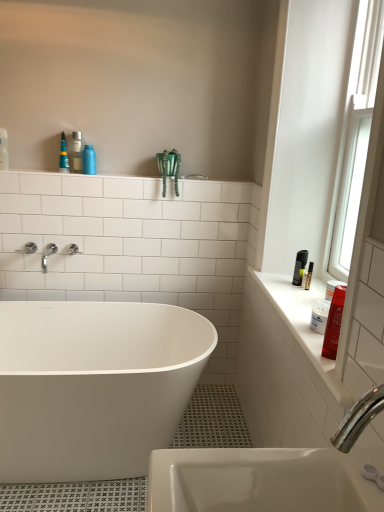
Question: Is point (334, 348) positioned closer to the camera than point (66, 387)?

Choices:
 (A) farther
 (B) closer

Answer: (B)

Question: Considering the positions of shiny red plastic bottle at right, the first toiletry in the front-to-back sequence, and white glossy bathtub at center in the image, is shiny red plastic bottle at right, the first toiletry in the front-to-back sequence, taller or shorter than white glossy bathtub at center?

Choices:
 (A) short
 (B) tall

Answer: (A)

Question: Estimate the real-world distances between objects in this image. Which object is farther from the white glass window at right?

Choices:
 (A) white glossy bathtub at center
 (B) silver metallic faucet at upper left
 (C) blue plastic bottle at upper center, the first toiletry in the top-to-bottom sequence
 (D) shiny red plastic bottle at right, the 1th toiletry from the bottom
 (E) white glossy counter top at right

Answer: (B)

Question: Which is farther from the shiny red plastic bottle at right, positioned as the second toiletry in left-to-right order?

Choices:
 (A) silver metallic faucet at upper left
 (B) blue plastic bottle at upper center, acting as the 2th toiletry starting from the front
 (C) white glass window at right
 (D) white glossy counter top at right
 (E) white glossy bathtub at center

Answer: (A)